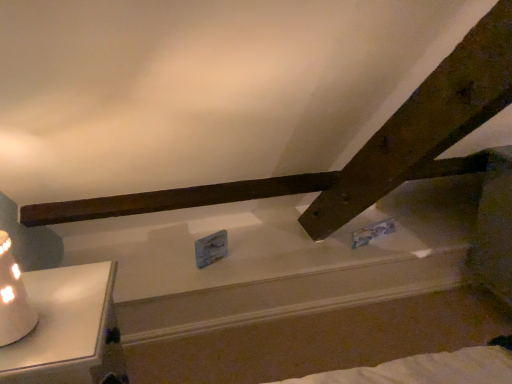
Image resolution: width=512 pixels, height=384 pixels. Identify the location of white ceramic table lamp at lower left. (13, 298).

Measure the distance between white ceramic table lamp at lower left and camera.

A distance of 98.30 centimeters exists between white ceramic table lamp at lower left and camera.

This screenshot has width=512, height=384. Describe the element at coordinates (13, 298) in the screenshot. I see `white ceramic table lamp at lower left` at that location.

What do you see at coordinates (68, 329) in the screenshot?
I see `white glossy candlestick at lower left` at bounding box center [68, 329].

Locate an element on the screen. The height and width of the screenshot is (384, 512). white glossy candlestick at lower left is located at coordinates (68, 329).

Where is `white ceramic table lamp at lower left`? This screenshot has width=512, height=384. white ceramic table lamp at lower left is located at coordinates (13, 298).

Which is more to the left, white ceramic table lamp at lower left or white glossy candlestick at lower left?

From the viewer's perspective, white ceramic table lamp at lower left appears more on the left side.

Who is more distant, white ceramic table lamp at lower left or white glossy candlestick at lower left?

white glossy candlestick at lower left is further from the camera.

Which is nearer, (28, 301) or (34, 349)?

Point (28, 301) is positioned farther from the camera compared to point (34, 349).

From the image's perspective, which object appears higher, white ceramic table lamp at lower left or white glossy candlestick at lower left?

white ceramic table lamp at lower left appears higher in the image.

From a real-world perspective, between white ceramic table lamp at lower left and white glossy candlestick at lower left, who is vertically higher?

white ceramic table lamp at lower left, from a real-world perspective.

In terms of width, does white ceramic table lamp at lower left look wider or thinner when compared to white glossy candlestick at lower left?

In the image, white ceramic table lamp at lower left appears to be more narrow than white glossy candlestick at lower left.

Is white ceramic table lamp at lower left shorter than white glossy candlestick at lower left?

Yes, white ceramic table lamp at lower left is shorter than white glossy candlestick at lower left.

Based on their sizes in the image, would you say white ceramic table lamp at lower left is bigger or smaller than white glossy candlestick at lower left?

Considering their sizes, white ceramic table lamp at lower left takes up less space than white glossy candlestick at lower left.

Is white ceramic table lamp at lower left located outside white glossy candlestick at lower left?

Yes, white ceramic table lamp at lower left is not within white glossy candlestick at lower left.

Is the surface of white ceramic table lamp at lower left in direct contact with white glossy candlestick at lower left?

No, white ceramic table lamp at lower left is not in contact with white glossy candlestick at lower left.

Is white glossy candlestick at lower left at the back of white ceramic table lamp at lower left?

No.

Based on the photo, how different are the orientations of white ceramic table lamp at lower left and white glossy candlestick at lower left in degrees?

The facing directions of white ceramic table lamp at lower left and white glossy candlestick at lower left are 3.81 degrees apart.

At what (x,y) coordinates should I click in order to perform the action: click on table lamp on the left side of white glossy candlestick at lower left. Please return your answer as a coordinate pair (x, y). This screenshot has height=384, width=512. Looking at the image, I should click on (13, 298).

Between white glossy candlestick at lower left and white ceramic table lamp at lower left, which one appears on the left side from the viewer's perspective?

white ceramic table lamp at lower left is more to the left.

Considering the relative positions of white glossy candlestick at lower left and white ceramic table lamp at lower left in the image provided, is white glossy candlestick at lower left in front of white ceramic table lamp at lower left?

No, white glossy candlestick at lower left is further to the viewer.

Does point (86, 370) appear closer or farther from the camera than point (20, 284)?

Point (86, 370) is closer to the camera than point (20, 284).

From the image's perspective, is white glossy candlestick at lower left located beneath white ceramic table lamp at lower left?

Yes.

From a real-world perspective, which is physically above, white glossy candlestick at lower left or white ceramic table lamp at lower left?

white ceramic table lamp at lower left.

Can you confirm if white glossy candlestick at lower left is wider than white ceramic table lamp at lower left?

Correct, the width of white glossy candlestick at lower left exceeds that of white ceramic table lamp at lower left.

Does white glossy candlestick at lower left have a lesser height compared to white ceramic table lamp at lower left?

No.

Based on their sizes in the image, would you say white glossy candlestick at lower left is bigger or smaller than white ceramic table lamp at lower left?

white glossy candlestick at lower left is bigger than white ceramic table lamp at lower left.

Could white ceramic table lamp at lower left be considered to be inside white glossy candlestick at lower left?

No, white ceramic table lamp at lower left is located outside of white glossy candlestick at lower left.

Is white glossy candlestick at lower left not close to white ceramic table lamp at lower left?

white glossy candlestick at lower left is actually quite close to white ceramic table lamp at lower left.

Is white glossy candlestick at lower left aimed at white ceramic table lamp at lower left?

No.

I want to click on furniture located on the right of white ceramic table lamp at lower left, so click(x=68, y=329).

Image resolution: width=512 pixels, height=384 pixels. I want to click on furniture that appears below the white ceramic table lamp at lower left (from the image's perspective), so click(68, 329).

The width and height of the screenshot is (512, 384). In order to click on furniture below the white ceramic table lamp at lower left (from a real-world perspective) in this screenshot , I will do point(68,329).